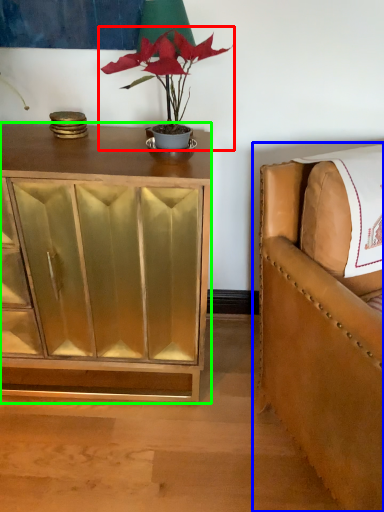
Question: Which object is the closest to the houseplant (highlighted by a red box)? Choose among these: chair (highlighted by a blue box) or cabinetry (highlighted by a green box).

Choices:
 (A) chair
 (B) cabinetry

Answer: (B)